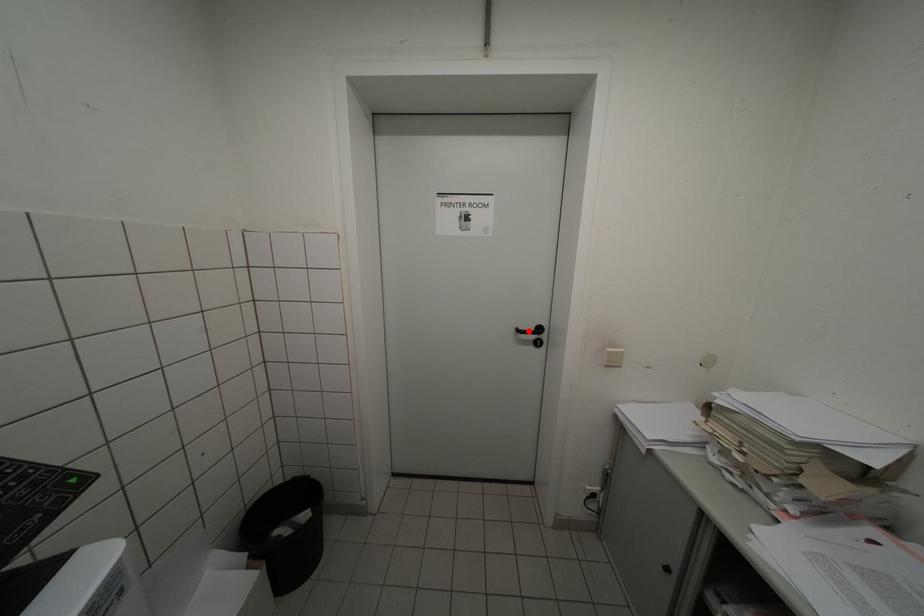
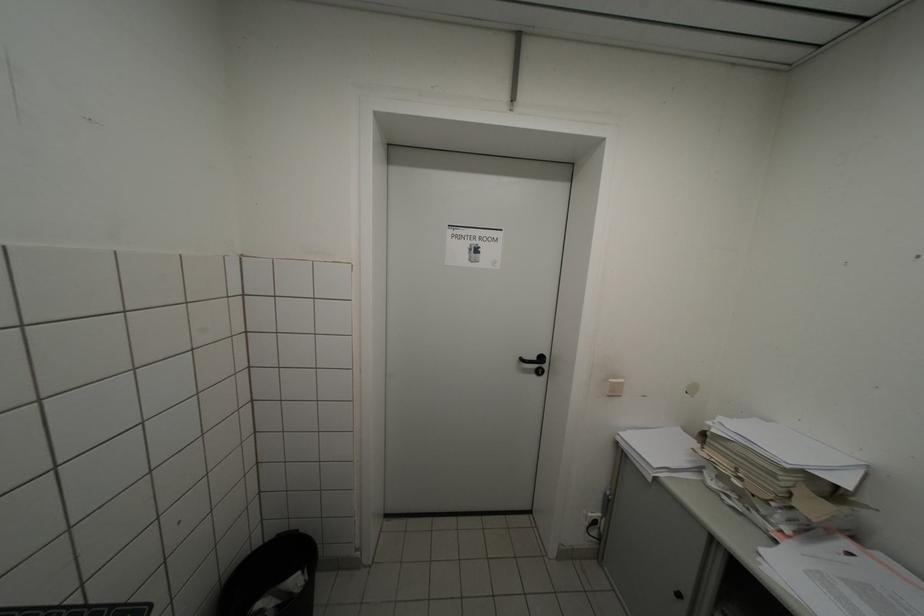
Locate, in the second image, the point that corresponds to the highlighted location in the first image.

(532, 361)